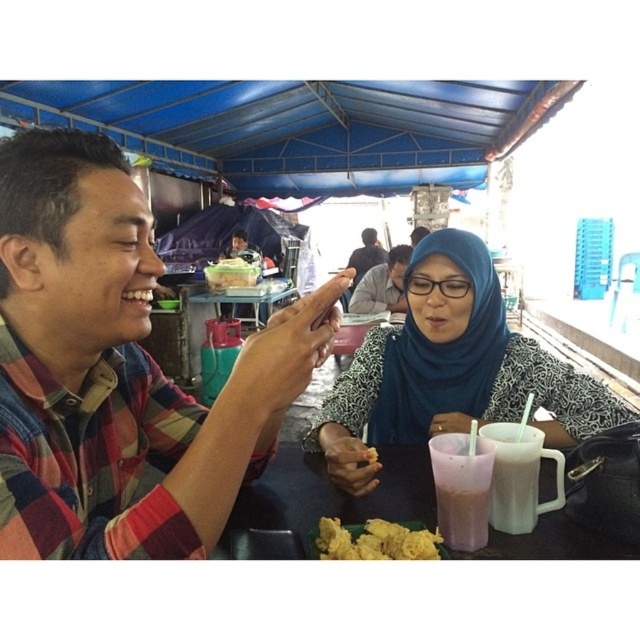
Question: Can you confirm if pink smoothie at lower center is positioned below yellow fried food at lower center?

Choices:
 (A) yes
 (B) no

Answer: (B)

Question: Is matte black shirt at center to the left of dark blue fabric headscarf at center from the viewer's perspective?

Choices:
 (A) yes
 (B) no

Answer: (B)

Question: Which object is positioned farthest from the green leafy vegetable at center?

Choices:
 (A) matte white mug at lower right
 (B) pink smoothie at lower center

Answer: (B)

Question: Estimate the real-world distances between objects in this image. Which object is farther from the matte black shirt at center?

Choices:
 (A) yellow fried food at lower center
 (B) pink smoothie at lower center

Answer: (A)

Question: Is yellow fried food at lower center thinner than green leafy vegetable at center?

Choices:
 (A) no
 (B) yes

Answer: (B)

Question: Which object is closer to the camera taking this photo?

Choices:
 (A) matte black shirt at center
 (B) pink plastic table at lower center
 (C) pink smoothie at lower center
 (D) blue printed dress at center

Answer: (B)